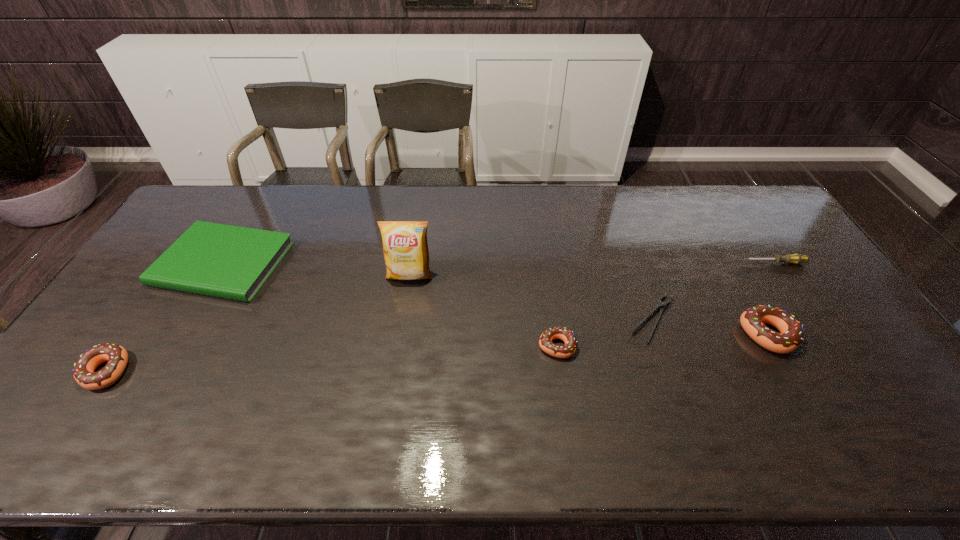
The image size is (960, 540). I want to click on free space between the screwdriver and the third object from right to left, so click(x=713, y=291).

Where is `unoccupied area between the rightmost doughnut and the second tallest doughnut`? The height and width of the screenshot is (540, 960). unoccupied area between the rightmost doughnut and the second tallest doughnut is located at coordinates click(x=437, y=353).

Identify the location of unoccupied position between the second tallest doughnut and the fourth object from right to left. Image resolution: width=960 pixels, height=540 pixels. (331, 359).

Locate an element on the screen. vacant area that lies between the tallest object and the shortest doughnut is located at coordinates (484, 311).

What are the coordinates of `free space between the crisp (potato chip) and the screwdriver` in the screenshot? It's located at (592, 269).

Locate an element on the screen. The width and height of the screenshot is (960, 540). free space between the second tallest object and the paperback book is located at coordinates (495, 299).

Locate an element on the screen. This screenshot has height=540, width=960. free area in between the fifth object from right to left and the sixth shortest object is located at coordinates (588, 305).

The width and height of the screenshot is (960, 540). I want to click on free space between the leftmost doughnut and the screwdriver, so [x=441, y=317].

I want to click on free space between the tallest doughnut and the tallest object, so click(x=588, y=305).

This screenshot has height=540, width=960. Identify the location of object that ranks as the fifth closest to the leftmost doughnut. (752, 320).